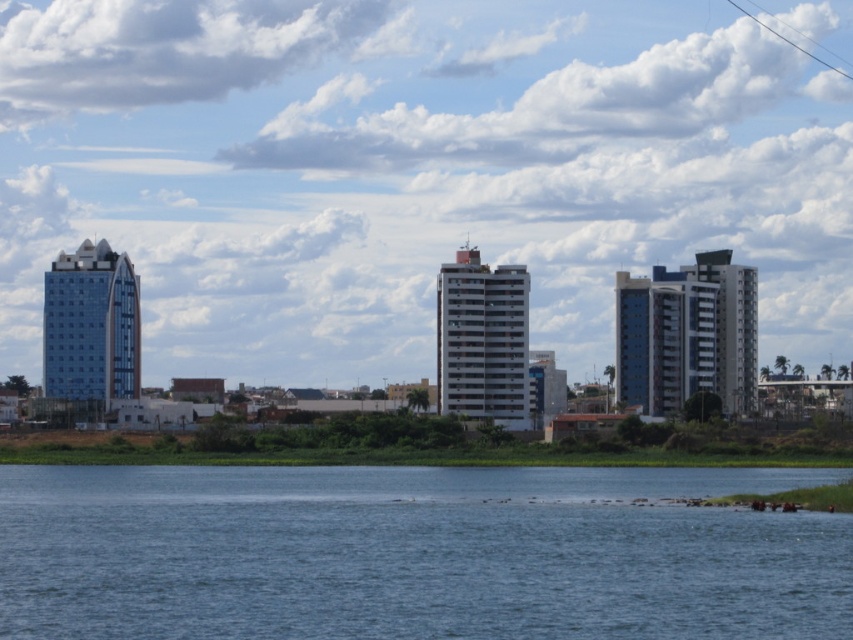
Question: Considering the relative positions of blue glass building at right and glassy blue skyscraper at left in the image provided, where is blue glass building at right located with respect to glassy blue skyscraper at left?

Choices:
 (A) left
 (B) right

Answer: (B)

Question: Which point is farther to the camera?

Choices:
 (A) blue glass building at right
 (B) blue water at lower center
 (C) glassy blue skyscraper at left
 (D) white smooth building at center

Answer: (C)

Question: Among these objects, which one is nearest to the camera?

Choices:
 (A) blue glass building at right
 (B) blue water at lower center

Answer: (B)

Question: Is blue glass building at right to the right of glassy blue skyscraper at left from the viewer's perspective?

Choices:
 (A) yes
 (B) no

Answer: (A)

Question: Which point is closer to the camera?

Choices:
 (A) (494, 346)
 (B) (102, 364)
 (C) (250, 518)

Answer: (C)

Question: Does blue glass building at right have a smaller size compared to white smooth building at center?

Choices:
 (A) yes
 (B) no

Answer: (B)